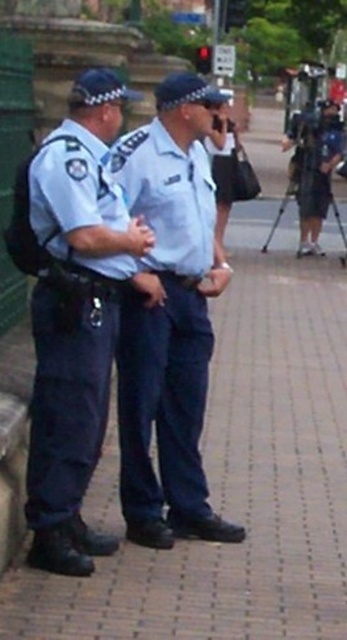
Question: Is blue uniform at center thinner than matte blue uniform at left?

Choices:
 (A) yes
 (B) no

Answer: (B)

Question: Which point is closer to the camera taking this photo?

Choices:
 (A) (45, 378)
 (B) (174, 508)

Answer: (A)

Question: Which of the following is the closest to the observer?

Choices:
 (A) matte blue uniform at left
 (B) blue uniform at center

Answer: (A)

Question: Can you confirm if blue uniform at center is thinner than matte blue uniform at left?

Choices:
 (A) no
 (B) yes

Answer: (A)

Question: From the image, what is the correct spatial relationship of blue uniform at center in relation to matte blue uniform at left?

Choices:
 (A) right
 (B) left

Answer: (A)